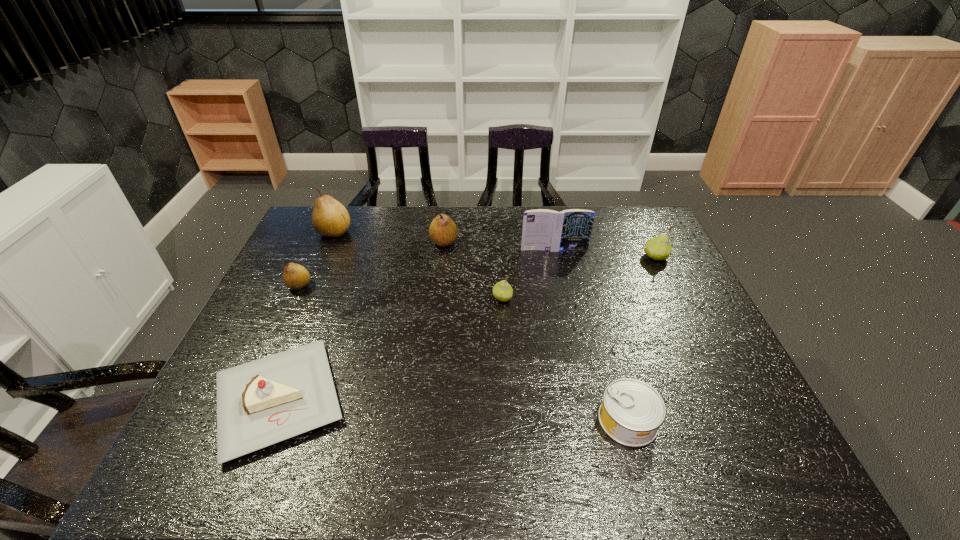
Where is `empty space that is in between the fifth object from left to right and the white cake`? This screenshot has width=960, height=540. empty space that is in between the fifth object from left to right and the white cake is located at coordinates (391, 348).

I want to click on free area in between the nearest brown pear and the biggest brown pear, so click(317, 259).

The width and height of the screenshot is (960, 540). I want to click on unoccupied area between the fourth object from left to right and the biggest brown pear, so click(390, 237).

The height and width of the screenshot is (540, 960). Find the location of `free spot between the rightmost pear and the cake`. free spot between the rightmost pear and the cake is located at coordinates (468, 328).

Locate an element on the screen. The image size is (960, 540). free space that is in between the can and the rightmost object is located at coordinates (641, 339).

Where is `free space between the left green pear and the second biggest brown pear`? Image resolution: width=960 pixels, height=540 pixels. free space between the left green pear and the second biggest brown pear is located at coordinates [473, 270].

In order to click on vacant area that lies between the third pear from right to left and the can in this screenshot , I will do `click(536, 331)`.

Image resolution: width=960 pixels, height=540 pixels. I want to click on free space between the second smallest brown pear and the biggest brown pear, so click(x=390, y=237).

I want to click on vacant area between the book and the fourth object from right to left, so click(528, 274).

What are the coordinates of `vacant space in between the cake and the biggest brown pear` in the screenshot? It's located at (307, 315).